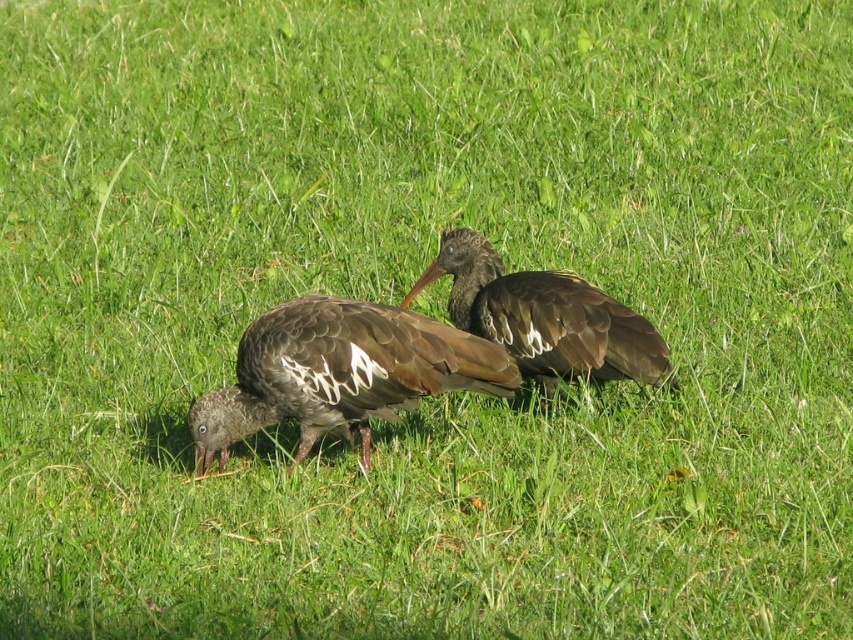
Question: Which point is closer to the camera?

Choices:
 (A) brown feathered bird at center
 (B) brown matte bird at center

Answer: (A)

Question: Can you confirm if brown feathered bird at center is positioned to the left of brown matte bird at center?

Choices:
 (A) no
 (B) yes

Answer: (B)

Question: Which point is farther to the camera?

Choices:
 (A) (450, 390)
 (B) (610, 340)

Answer: (B)

Question: Is the position of brown feathered bird at center less distant than that of brown matte bird at center?

Choices:
 (A) yes
 (B) no

Answer: (A)

Question: Which object is closer to the camera taking this photo?

Choices:
 (A) brown feathered bird at center
 (B) brown matte bird at center

Answer: (A)

Question: Is brown feathered bird at center smaller than brown matte bird at center?

Choices:
 (A) no
 (B) yes

Answer: (A)